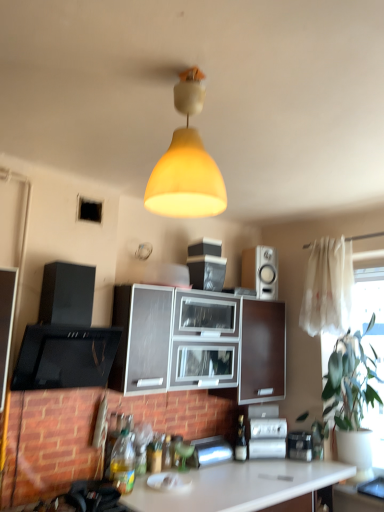
Where is `vacant region in front of metallic silver toaster at lower center, which is the 3th appliance from right to left`? Image resolution: width=384 pixels, height=512 pixels. vacant region in front of metallic silver toaster at lower center, which is the 3th appliance from right to left is located at coordinates (229, 472).